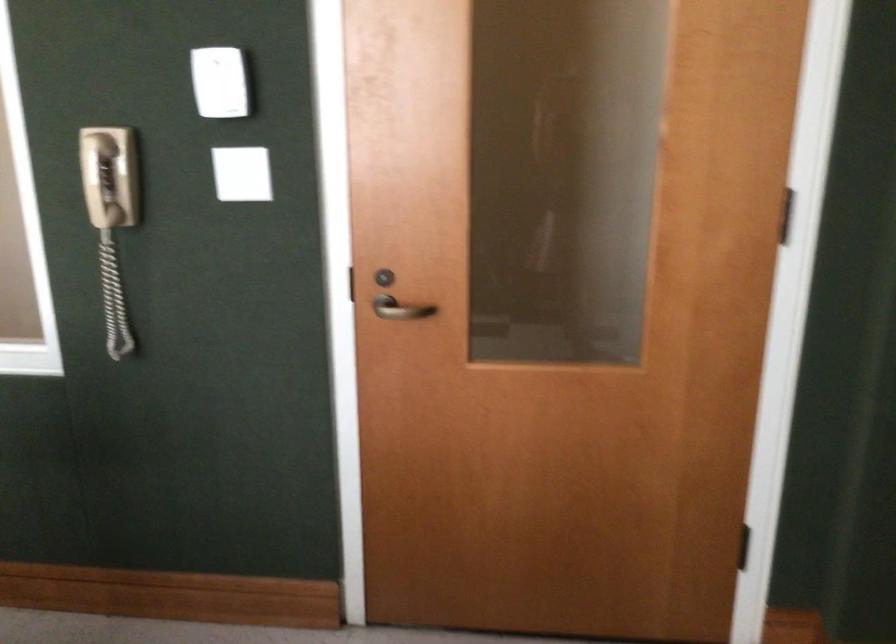
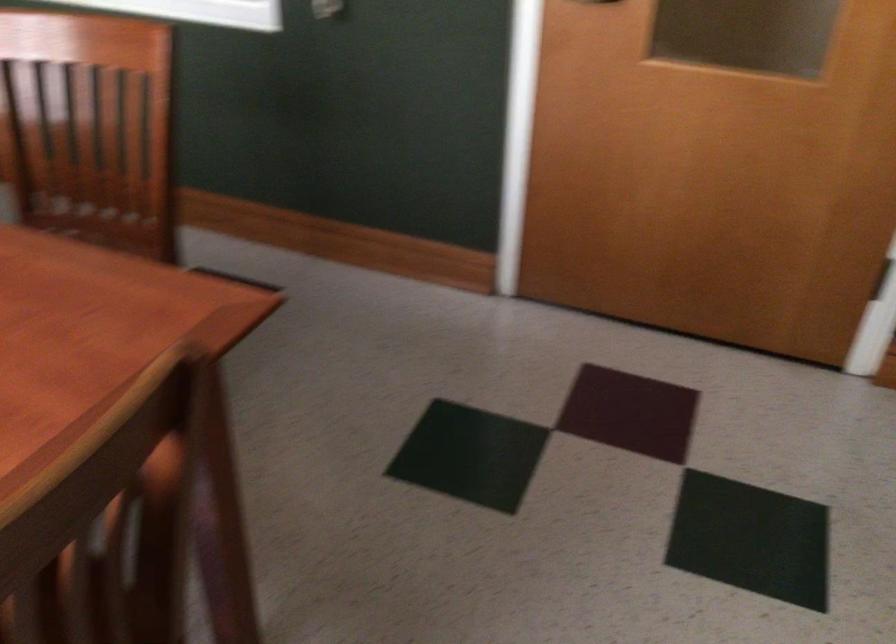
Question: The images are taken continuously from a first-person perspective. In which direction are you moving?

Choices:
 (A) Left
 (B) Right
 (C) Forward
 (D) Backward

Answer: (D)